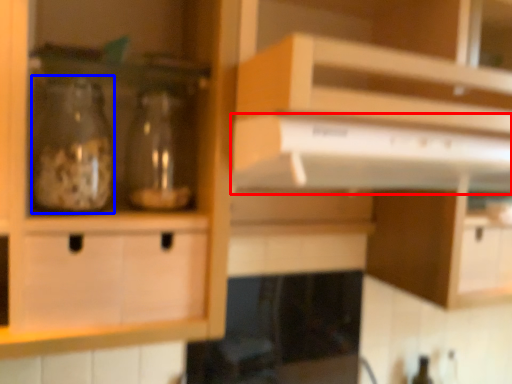
Question: Which point is closer to the camera, exhaust hood (highlighted by a red box) or glass bottle (highlighted by a blue box)?

Choices:
 (A) exhaust hood
 (B) glass bottle

Answer: (A)